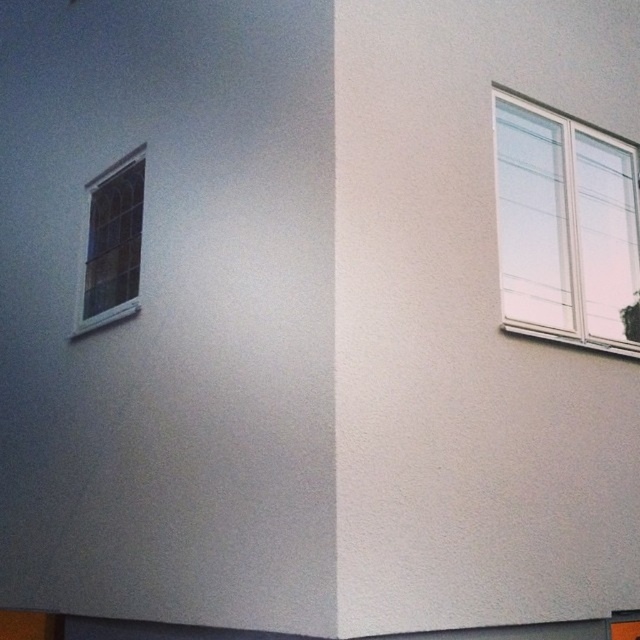
Looking at this image, you are a window installer who needs to replace the clear glass window at upper right and the clear glass window at upper left. Which window requires a larger glass pane?

The clear glass window at upper right requires a larger glass pane since it is larger in size than the clear glass window at upper left according to the description.